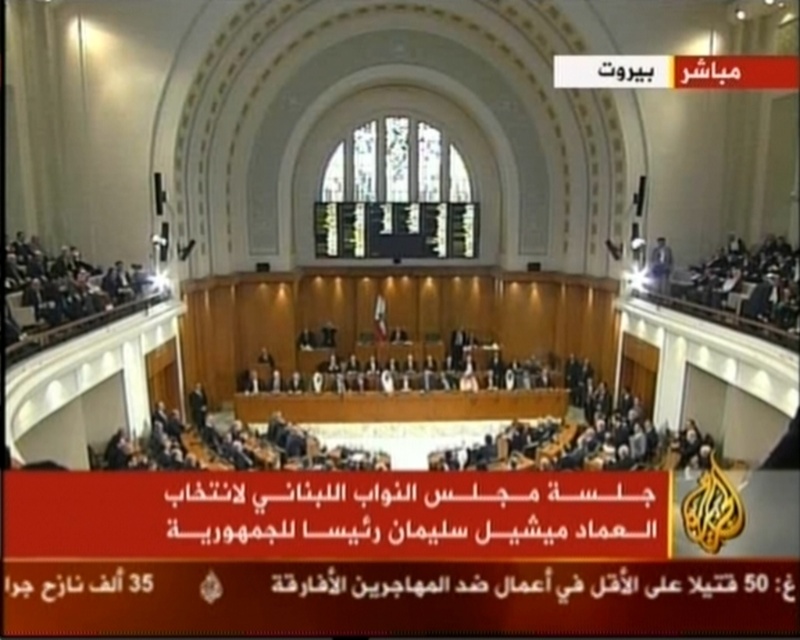
Between dark brown wooden chair at upper left and white glossy microphone at upper center, which one has less height?

white glossy microphone at upper center is shorter.

Is dark brown wooden chair at upper left to the right of white glossy microphone at upper center from the viewer's perspective?

No, dark brown wooden chair at upper left is not to the right of white glossy microphone at upper center.

Find the location of a particular element. The height and width of the screenshot is (640, 800). dark brown wooden chair at upper left is located at coordinates (66, 284).

The image size is (800, 640). I want to click on dark brown wooden chair at upper left, so click(66, 284).